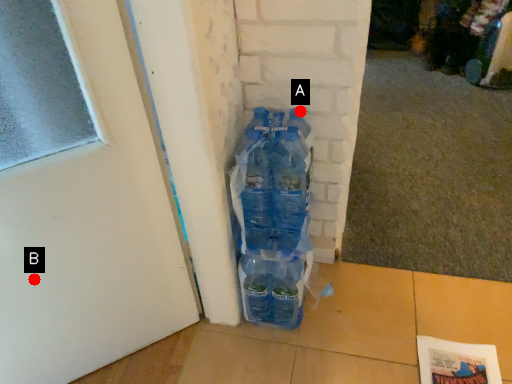
Question: Two points are circled on the image, labeled by A and B beside each circle. Among these points, which one is nearest to the camera?

Choices:
 (A) A is closer
 (B) B is closer

Answer: (B)